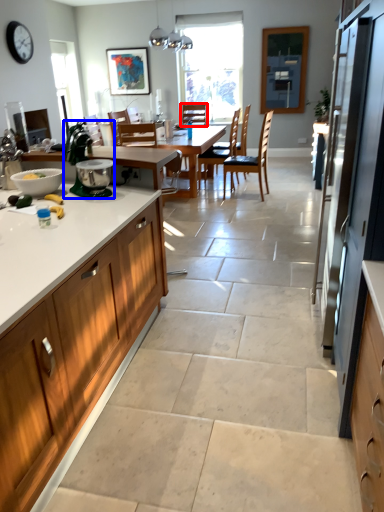
Question: Which of the following is the farthest to the observer, chair (highlighted by a red box) or appliance (highlighted by a blue box)?

Choices:
 (A) chair
 (B) appliance

Answer: (A)